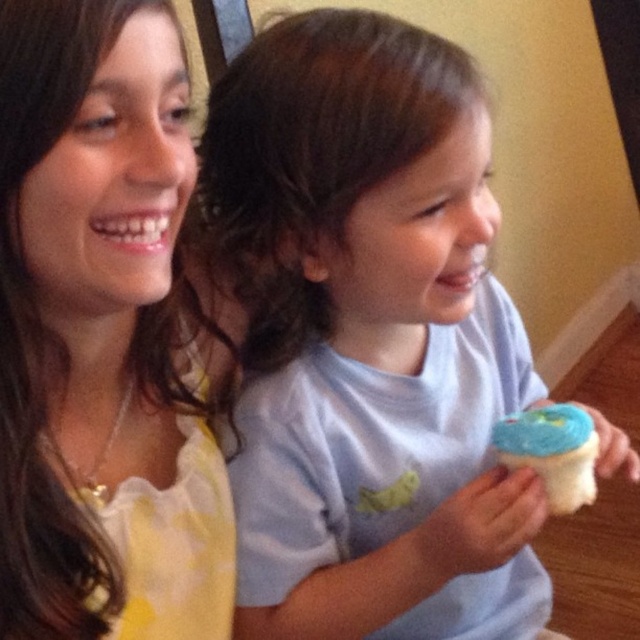
Is white matte cupcake at center below matte yellow shirt at upper left?

Indeed, white matte cupcake at center is positioned under matte yellow shirt at upper left.

Between white matte cupcake at center and matte yellow shirt at upper left, which one has less height?

With less height is matte yellow shirt at upper left.

What are the coordinates of `white matte cupcake at center` in the screenshot? It's located at (369, 339).

Consider the image. Is matte yellow shirt at upper left closer to camera compared to blue frosting cupcake at right?

That is True.

Which of these two, matte yellow shirt at upper left or blue frosting cupcake at right, stands taller?

With more height is matte yellow shirt at upper left.

Image resolution: width=640 pixels, height=640 pixels. Identify the location of matte yellow shirt at upper left. (104, 336).

Is white matte cupcake at center bigger than blue frosting cupcake at right?

Yes.

Is white matte cupcake at center thinner than blue frosting cupcake at right?

No.

Is point (369, 608) positioned in front of point (573, 464)?

No, (369, 608) is further to viewer.

Where is `white matte cupcake at center`? This screenshot has height=640, width=640. white matte cupcake at center is located at coordinates (369, 339).